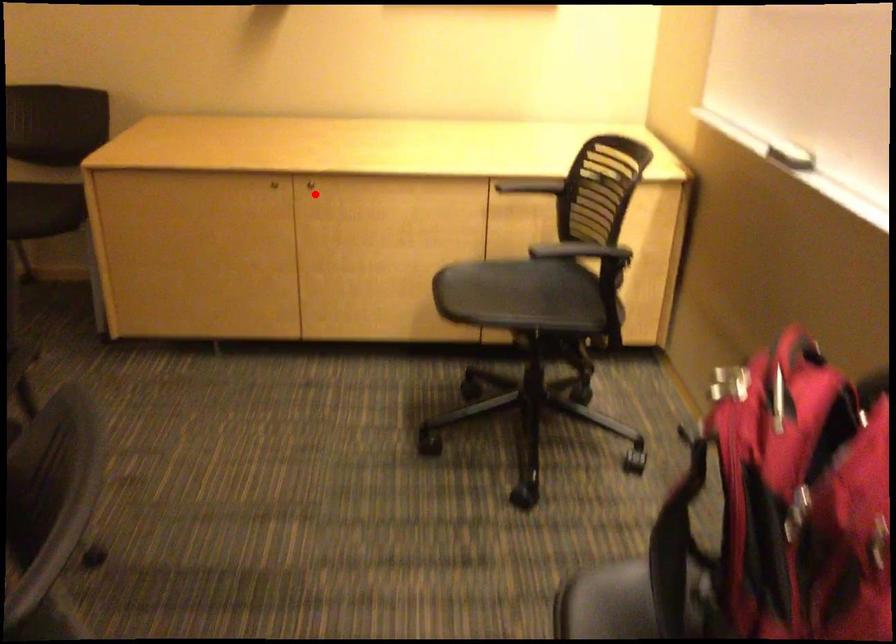
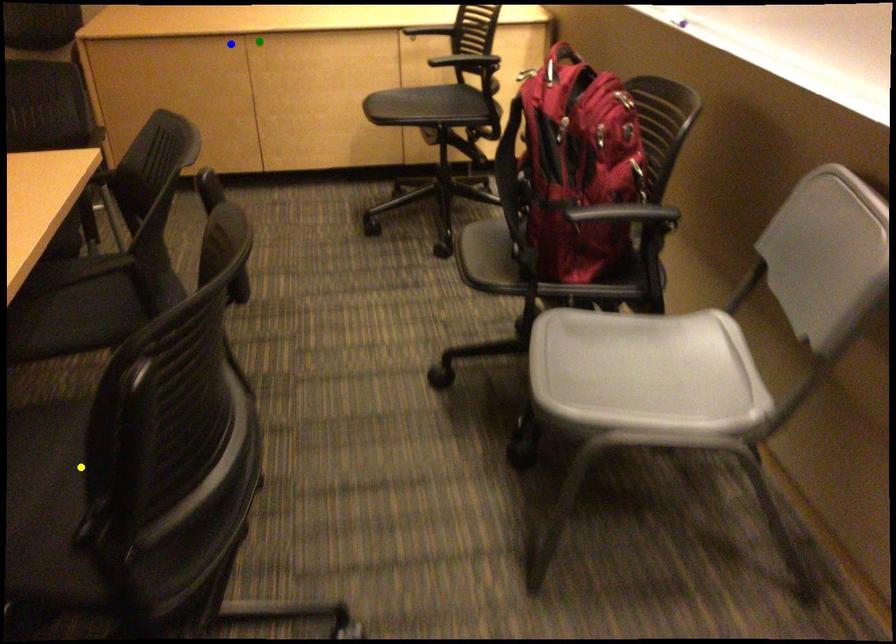
Question: I am providing you with two images of the same scene from different viewpoints. A red point is marked on the first image. You are given multiple points on the second image. In image 2, which mark is for the same physical point as the one in image 1?

Choices:
 (A) blue point
 (B) yellow point
 (C) green point

Answer: (C)